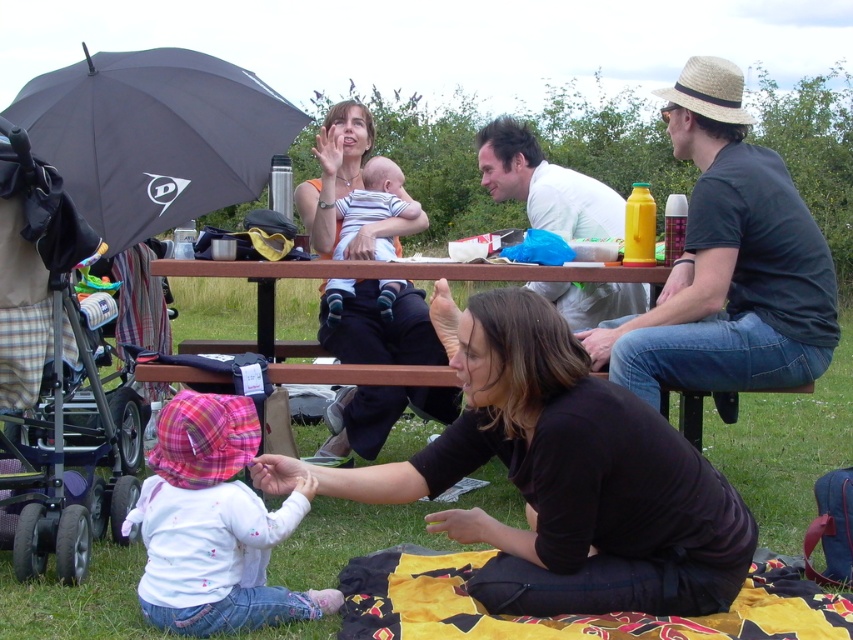
Which of these two, black matte shirt at center or dark gray cotton shirt at upper right, stands shorter?

Standing shorter between the two is black matte shirt at center.

Can you confirm if black matte shirt at center is positioned below dark gray cotton shirt at upper right?

Yes.

Which is behind, point (537, 444) or point (680, 252)?

The point (680, 252) is behind.

You are a GUI agent. You are given a task and a screenshot of the screen. Output one action in this format:
    pyautogui.click(x=<x>, y=<y>)
    Task: Click on the black matte shirt at center
    This screenshot has width=853, height=640.
    Given the screenshot: What is the action you would take?
    (569, 480)

Is dark gray cotton shirt at upper right closer to camera compared to yellow patterned fabric at lower center?

No.

Is dark gray cotton shirt at upper right bigger than yellow patterned fabric at lower center?

Yes.

Between point (718, 248) and point (386, 636), which one is positioned behind?

Positioned behind is point (718, 248).

This screenshot has width=853, height=640. What are the coordinates of `dark gray cotton shirt at upper right` in the screenshot? It's located at (728, 262).

Which is in front, point (180, 570) or point (372, 634)?

Point (372, 634)

Can you confirm if white cotton shirt at lower left is smaller than yellow patterned fabric at lower center?

Actually, white cotton shirt at lower left might be larger than yellow patterned fabric at lower center.

Is point (270, 589) in front of point (769, 608)?

Yes, point (270, 589) is closer to viewer.

What are the coordinates of `white cotton shirt at lower left` in the screenshot? It's located at (213, 525).